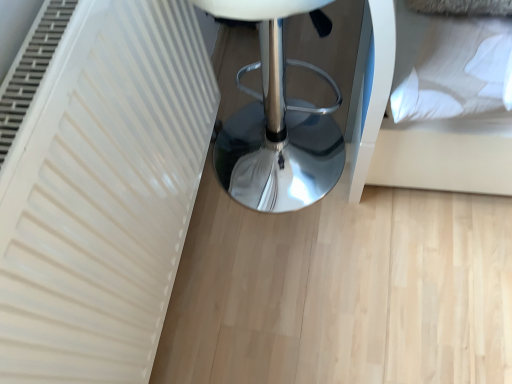
Question: Is white glossy stool at center to the right of white soft pillow at upper right from the viewer's perspective?

Choices:
 (A) yes
 (B) no

Answer: (B)

Question: Is white glossy stool at center at the left side of white soft pillow at upper right?

Choices:
 (A) yes
 (B) no

Answer: (A)

Question: Considering the relative sizes of white glossy stool at center and white soft pillow at upper right in the image provided, is white glossy stool at center shorter than white soft pillow at upper right?

Choices:
 (A) yes
 (B) no

Answer: (B)

Question: Is white glossy stool at center facing away from white soft pillow at upper right?

Choices:
 (A) no
 (B) yes

Answer: (A)

Question: Is white glossy stool at center thinner than white soft pillow at upper right?

Choices:
 (A) yes
 (B) no

Answer: (B)

Question: Does white glossy stool at center have a greater height compared to white soft pillow at upper right?

Choices:
 (A) no
 (B) yes

Answer: (B)

Question: Could white glossy stool at center be considered to be inside white soft pillow at upper right?

Choices:
 (A) yes
 (B) no

Answer: (B)

Question: Is white soft pillow at upper right oriented towards white glossy stool at center?

Choices:
 (A) no
 (B) yes

Answer: (A)

Question: Is white soft pillow at upper right outside of white glossy stool at center?

Choices:
 (A) yes
 (B) no

Answer: (A)

Question: From the image's perspective, is white soft pillow at upper right located beneath white glossy stool at center?

Choices:
 (A) no
 (B) yes

Answer: (A)

Question: From a real-world perspective, is white soft pillow at upper right under white glossy stool at center?

Choices:
 (A) no
 (B) yes

Answer: (A)

Question: Is white soft pillow at upper right smaller than white glossy stool at center?

Choices:
 (A) yes
 (B) no

Answer: (A)

Question: From a real-world perspective, relative to white glossy stool at center, is white soft pillow at upper right vertically above or below?

Choices:
 (A) above
 (B) below

Answer: (A)